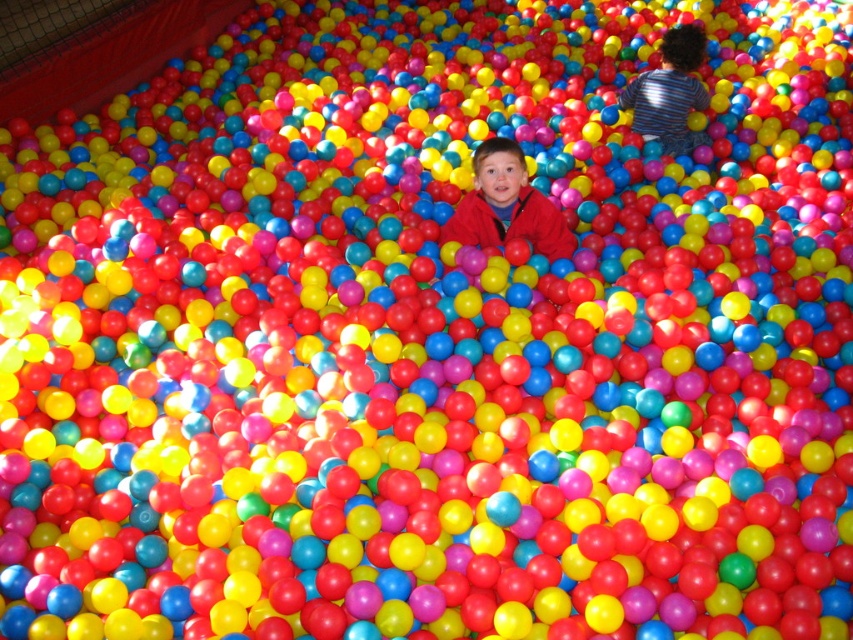
You are a parent trying to locate your child in the ball pit. You see the matte red jacket at center and the striped cotton shirt at center. Which clothing item is wider?

The matte red jacket at center is wider than the striped cotton shirt at center.

You are a parent trying to locate your child in the ball pit. You see the matte red jacket at center and the striped cotton shirt at center. Which child is lower in the ball pit?

The matte red jacket at center is located below striped cotton shirt at center, so the child wearing the matte red jacket at center is lower in the ball pit.